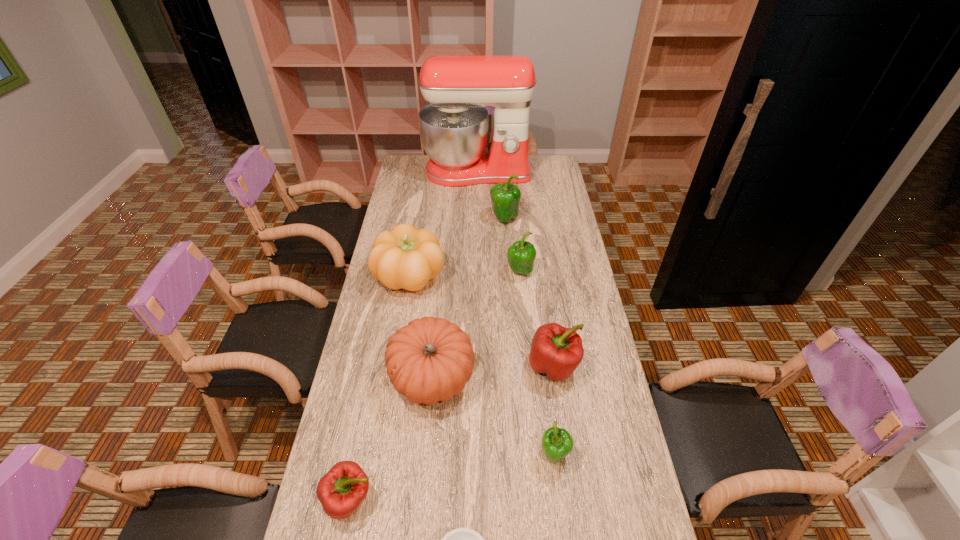
Locate an element on the screen. The image size is (960, 540). the bigger pink bell pepper is located at coordinates (557, 351).

You are a GUI agent. You are given a task and a screenshot of the screen. Output one action in this format:
    pyautogui.click(x=<x>, y=<y>)
    Task: Click on the fourth farthest bell pepper
    
    Given the screenshot: What is the action you would take?
    pyautogui.click(x=557, y=443)

Locate an element on the screen. The width and height of the screenshot is (960, 540). the nearest green bell pepper is located at coordinates (557, 443).

I want to click on the nearer pink bell pepper, so click(343, 488).

Identify the location of the smaller pink bell pepper. Image resolution: width=960 pixels, height=540 pixels. (343, 488).

What are the coordinates of `free space located on the front-facing side of the pink mixer` in the screenshot? It's located at (477, 205).

Where is `free space located 0.060m on the back of the farthest bell pepper`? free space located 0.060m on the back of the farthest bell pepper is located at coordinates (503, 202).

The height and width of the screenshot is (540, 960). Identify the location of free point located 0.260m on the back of the farther pumpkin. (420, 216).

Where is `free space located on the right of the nearer pumpkin`? This screenshot has width=960, height=540. free space located on the right of the nearer pumpkin is located at coordinates (596, 377).

Locate an element on the screen. This screenshot has width=960, height=540. free location located on the left of the second farthest bell pepper is located at coordinates (421, 272).